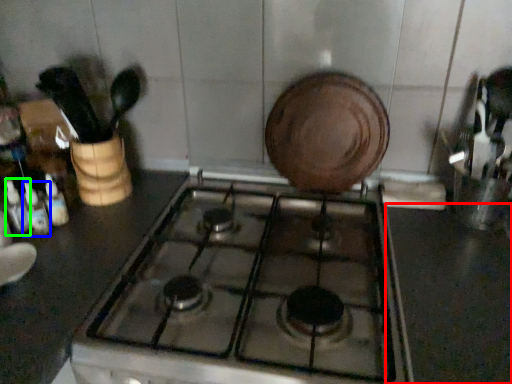
Question: Based on their relative distances, which object is nearer to counter top (highlighted by a red box)? Choose from bottle (highlighted by a blue box) and bottle (highlighted by a green box).

Choices:
 (A) bottle
 (B) bottle

Answer: (A)